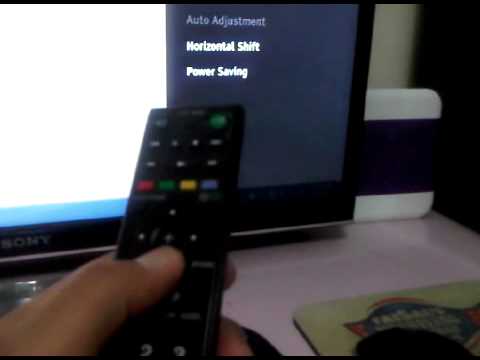
Where is `white and black device right of screen`? white and black device right of screen is located at coordinates (404, 150).